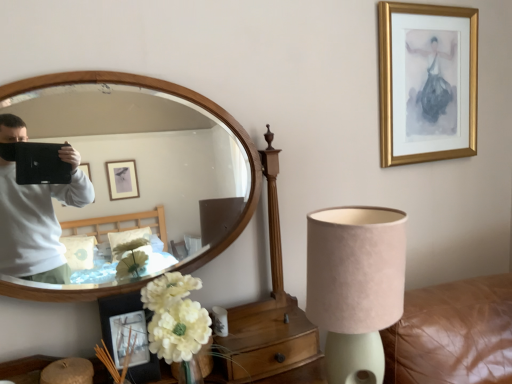
Question: Does white fabric flower at lower left have a larger size compared to gold framed picture at upper right, which is counted as the 2th picture frame, starting from the front?

Choices:
 (A) no
 (B) yes

Answer: (A)

Question: Is white fabric flower at lower left to the right of gold framed picture at upper right, the second picture frame in the left-to-right sequence, from the viewer's perspective?

Choices:
 (A) yes
 (B) no

Answer: (B)

Question: From the image's perspective, is white fabric flower at lower left located above gold framed picture at upper right, which is the 1th picture frame from back to front?

Choices:
 (A) yes
 (B) no

Answer: (B)

Question: Could you tell me if white fabric flower at lower left is turned towards gold framed picture at upper right, the 2th picture frame when ordered from bottom to top?

Choices:
 (A) no
 (B) yes

Answer: (A)

Question: From a real-world perspective, is white fabric flower at lower left under gold framed picture at upper right, placed as the first picture frame when sorted from top to bottom?

Choices:
 (A) yes
 (B) no

Answer: (A)

Question: From a real-world perspective, is gold framed picture at upper right, the second picture frame in the left-to-right sequence, physically located above or below matte black picture frame at lower left, which ranks as the second picture frame in back-to-front order?

Choices:
 (A) above
 (B) below

Answer: (A)

Question: Considering their positions, is gold framed picture at upper right, which is the 1th picture frame from back to front, located in front of or behind matte black picture frame at lower left, positioned as the 1th picture frame in left-to-right order?

Choices:
 (A) front
 (B) behind

Answer: (B)

Question: Is point (444, 6) closer or farther from the camera than point (120, 322)?

Choices:
 (A) closer
 (B) farther

Answer: (B)

Question: Based on their positions, is gold framed picture at upper right, which is counted as the first picture frame, starting from the right, located to the left or right of matte black picture frame at lower left, positioned as the 1th picture frame in front-to-back order?

Choices:
 (A) left
 (B) right

Answer: (B)

Question: Considering the positions of wooden mirror at left and suede lampshade at lower right in the image, is wooden mirror at left taller or shorter than suede lampshade at lower right?

Choices:
 (A) tall
 (B) short

Answer: (A)

Question: Is wooden mirror at left to the left or to the right of suede lampshade at lower right in the image?

Choices:
 (A) left
 (B) right

Answer: (A)

Question: Does point (195, 230) appear closer or farther from the camera than point (398, 292)?

Choices:
 (A) farther
 (B) closer

Answer: (A)

Question: From a real-world perspective, is wooden mirror at left positioned above or below suede lampshade at lower right?

Choices:
 (A) above
 (B) below

Answer: (A)

Question: Is point (153, 89) positioned closer to the camera than point (415, 107)?

Choices:
 (A) farther
 (B) closer

Answer: (B)

Question: From the image's perspective, is wooden mirror at left above or below gold framed picture at upper right, the second picture frame in the left-to-right sequence?

Choices:
 (A) below
 (B) above

Answer: (A)